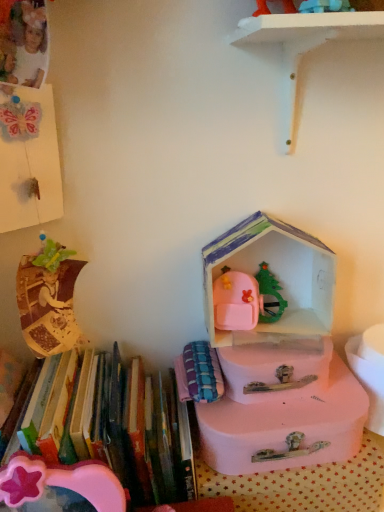
In order to click on spots to the right of plaid fabric book at center, the first book viewed from the right in this screenshot , I will do `click(294, 399)`.